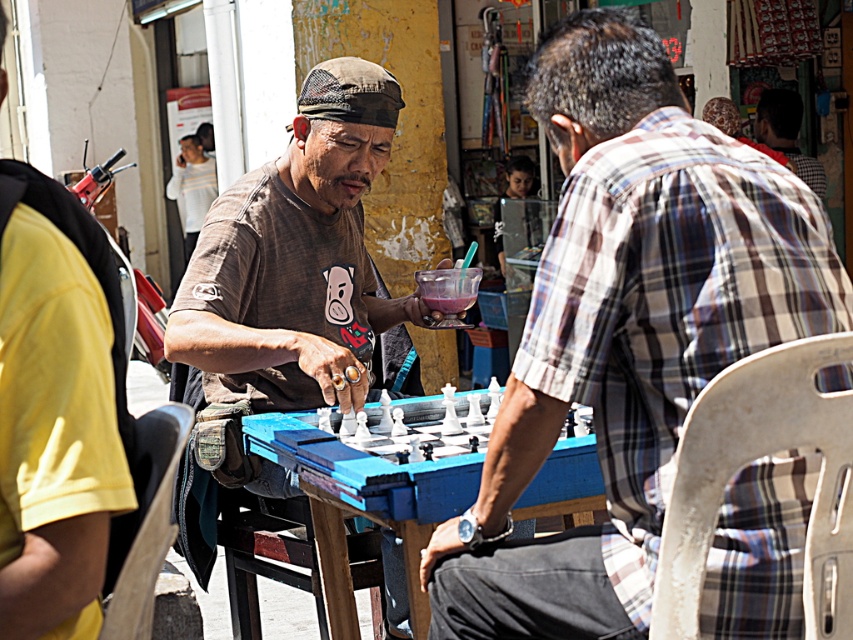
Is point (262, 259) behind point (410, 589)?

Yes, point (262, 259) is behind point (410, 589).

Does brown cotton shirt at center appear under blue plastic table at center?

No.

Does point (415, 321) come behind point (587, 458)?

That is True.

Find the location of `brown cotton shirt at center`. brown cotton shirt at center is located at coordinates (296, 259).

Describe the element at coordinates (625, 326) in the screenshot. Image resolution: width=853 pixels, height=640 pixels. I see `plaid fabric shirt at center` at that location.

Is point (606, 618) less distant than point (413, 577)?

Yes, point (606, 618) is closer to viewer.

Image resolution: width=853 pixels, height=640 pixels. Identify the location of plaid fabric shirt at center. (625, 326).

Is the position of plaid fabric shirt at center more distant than that of brown cotton shirt at center?

No, it is not.

Who is more forward, (x=544, y=35) or (x=363, y=358)?

Point (x=544, y=35) is in front.

Find the location of `plaid fabric shirt at center`. plaid fabric shirt at center is located at coordinates (625, 326).